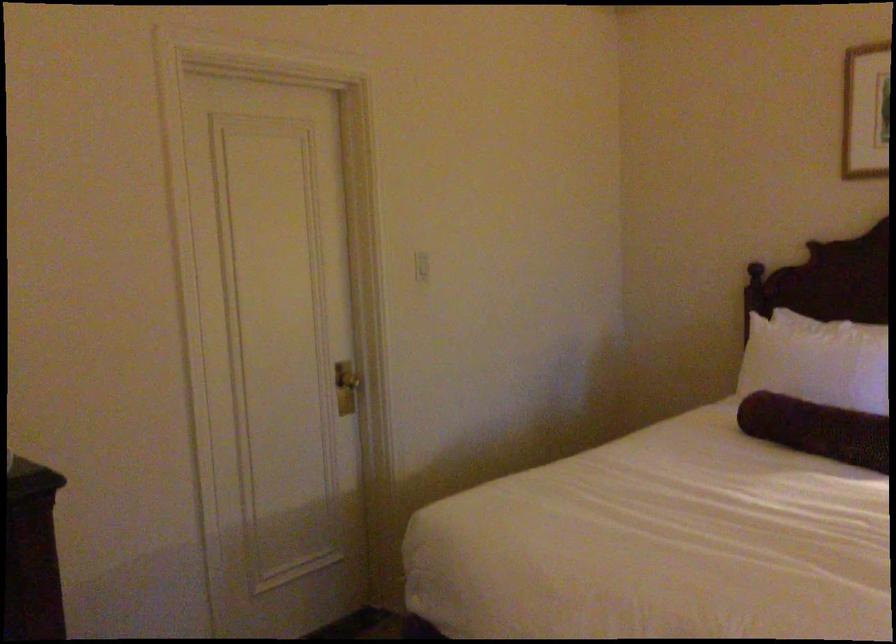
You are a GUI agent. You are given a task and a screenshot of the screen. Output one action in this format:
    pyautogui.click(x=<x>, y=<y>)
    Task: Click on the light switch plate
    
    Given the screenshot: What is the action you would take?
    click(420, 265)